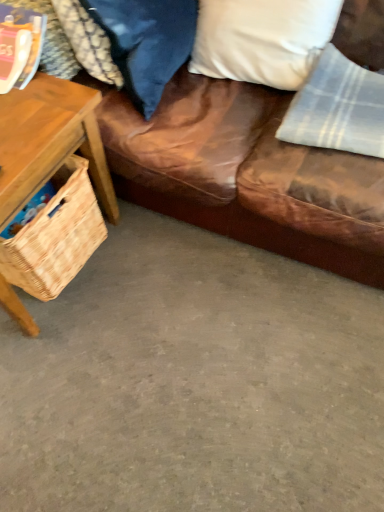
Question: Is velvet blue pillow at upper center, which is counted as the second pillow, starting from the right, inside light gray plaid fabric at upper right?

Choices:
 (A) no
 (B) yes

Answer: (A)

Question: Does light gray plaid fabric at upper right touch velvet blue pillow at upper center, placed as the 1th pillow when sorted from left to right?

Choices:
 (A) no
 (B) yes

Answer: (A)

Question: Is light gray plaid fabric at upper right thinner than velvet blue pillow at upper center, placed as the 1th pillow when sorted from left to right?

Choices:
 (A) no
 (B) yes

Answer: (A)

Question: Is light gray plaid fabric at upper right bigger than velvet blue pillow at upper center, placed as the 1th pillow when sorted from left to right?

Choices:
 (A) no
 (B) yes

Answer: (A)

Question: Considering the relative positions of light gray plaid fabric at upper right and velvet blue pillow at upper center, which is counted as the second pillow, starting from the right, in the image provided, is light gray plaid fabric at upper right to the left of velvet blue pillow at upper center, which is counted as the second pillow, starting from the right, from the viewer's perspective?

Choices:
 (A) yes
 (B) no

Answer: (B)

Question: Is light gray plaid fabric at upper right not close to velvet blue pillow at upper center, placed as the 1th pillow when sorted from left to right?

Choices:
 (A) no
 (B) yes

Answer: (A)

Question: Is woven straw picnic basket at left facing away from white soft pillow at upper right, which is the 2th pillow in left-to-right order?

Choices:
 (A) no
 (B) yes

Answer: (A)

Question: Is woven straw picnic basket at left aimed at white soft pillow at upper right, which ranks as the first pillow in right-to-left order?

Choices:
 (A) yes
 (B) no

Answer: (A)

Question: Considering the relative sizes of woven straw picnic basket at left and white soft pillow at upper right, which is the 2th pillow in left-to-right order, in the image provided, is woven straw picnic basket at left thinner than white soft pillow at upper right, which is the 2th pillow in left-to-right order,?

Choices:
 (A) no
 (B) yes

Answer: (A)

Question: Does woven straw picnic basket at left have a greater height compared to white soft pillow at upper right, which is the 2th pillow in left-to-right order?

Choices:
 (A) no
 (B) yes

Answer: (A)

Question: From the image's perspective, does woven straw picnic basket at left appear higher than white soft pillow at upper right, which ranks as the first pillow in right-to-left order?

Choices:
 (A) yes
 (B) no

Answer: (B)

Question: Considering the relative sizes of woven straw picnic basket at left and white soft pillow at upper right, which ranks as the first pillow in right-to-left order, in the image provided, is woven straw picnic basket at left smaller than white soft pillow at upper right, which ranks as the first pillow in right-to-left order,?

Choices:
 (A) no
 (B) yes

Answer: (B)

Question: Is velvet blue pillow at upper center, placed as the 1th pillow when sorted from left to right, not close to woven wood basket at left?

Choices:
 (A) no
 (B) yes

Answer: (A)